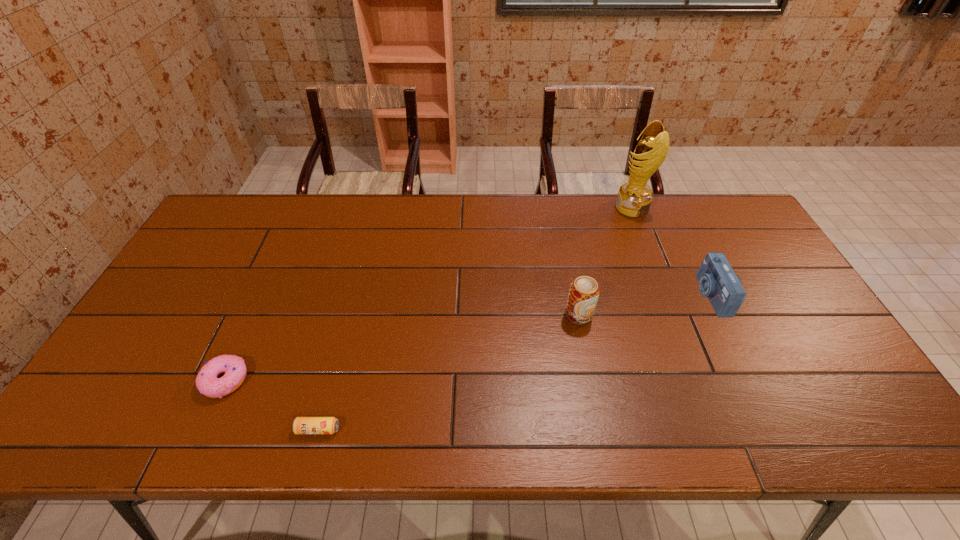
Find the location of a particular element. vacant area between the tallest object and the farther beer can is located at coordinates (605, 261).

Image resolution: width=960 pixels, height=540 pixels. In order to click on blank region between the left beer can and the third object from left to right in this screenshot , I will do [x=448, y=372].

Locate an element on the screen. This screenshot has width=960, height=540. free space that is in between the taller beer can and the shorter beer can is located at coordinates (448, 372).

Locate an element on the screen. free space between the shortest object and the tallest object is located at coordinates (475, 318).

Identify the location of empty location between the nearer beer can and the doughnut. Image resolution: width=960 pixels, height=540 pixels. (272, 405).

Where is `vacant area that lies between the tallest object and the camera`? The width and height of the screenshot is (960, 540). vacant area that lies between the tallest object and the camera is located at coordinates (671, 251).

Find the location of a particular element. The height and width of the screenshot is (540, 960). vacant region between the farther beer can and the camera is located at coordinates (645, 305).

Select which object appears as the third closest to the fourth object from left to right. Please provide its 2D coordinates. Your answer should be formatted as a tuple, i.e. [(x, y)], where the tuple contains the x and y coordinates of a point satisfying the conditions above.

[(302, 425)]

This screenshot has height=540, width=960. In order to click on the second closest object to the camera in this screenshot , I will do `click(583, 295)`.

At what (x,y) coordinates should I click in order to perform the action: click on vacant space that satisfies the following two spatial constraints: 1. on the lens of the third shortest object; 2. on the front side of the nearest object. Please return your answer as a coordinate pair (x, y). Looking at the image, I should click on (777, 429).